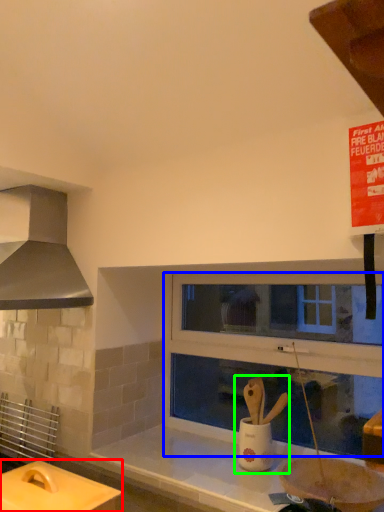
Question: Estimate the real-world distances between objects in this image. Which object is closer to table (highlighted by a red box), window frame (highlighted by a blue box) or sink (highlighted by a green box)?

Choices:
 (A) window frame
 (B) sink

Answer: (B)